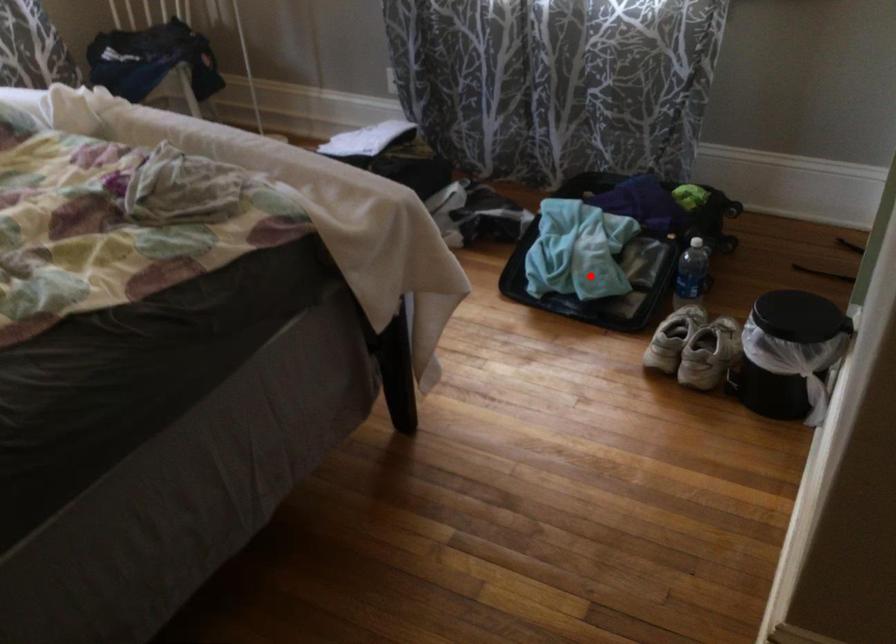
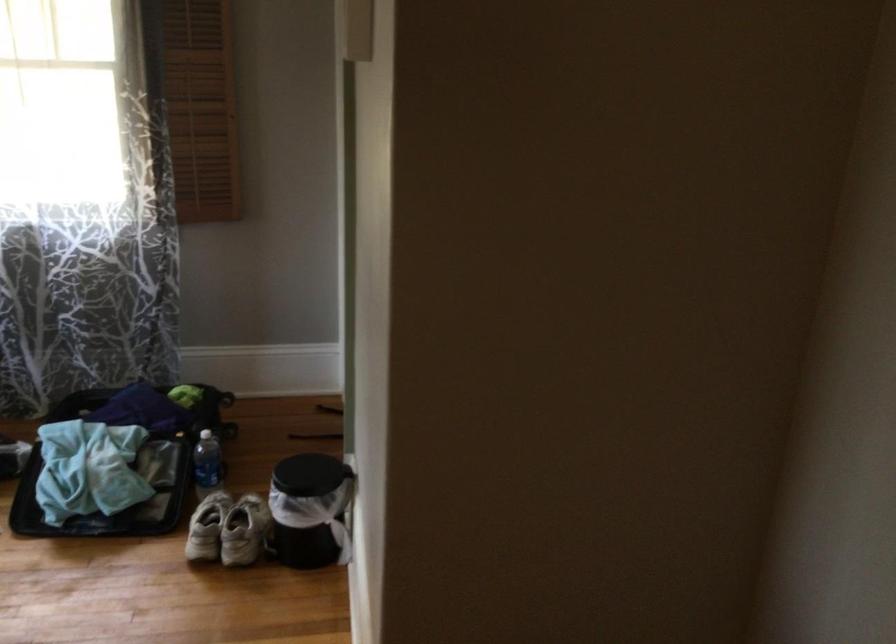
The point at the highlighted location is marked in the first image. Where is the corresponding point in the second image?

(110, 491)